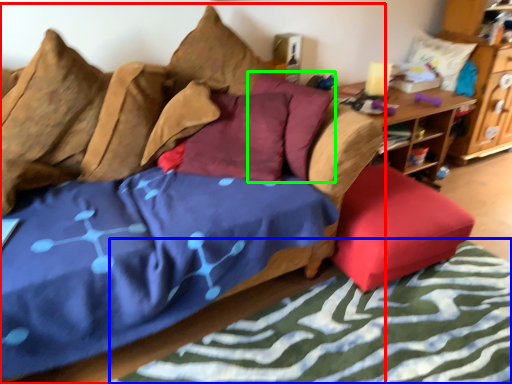
Question: Estimate the real-world distances between objects in this image. Which object is closer to studio couch (highlighted by a red box), bed frame (highlighted by a blue box) or pillow (highlighted by a green box)?

Choices:
 (A) bed frame
 (B) pillow

Answer: (B)